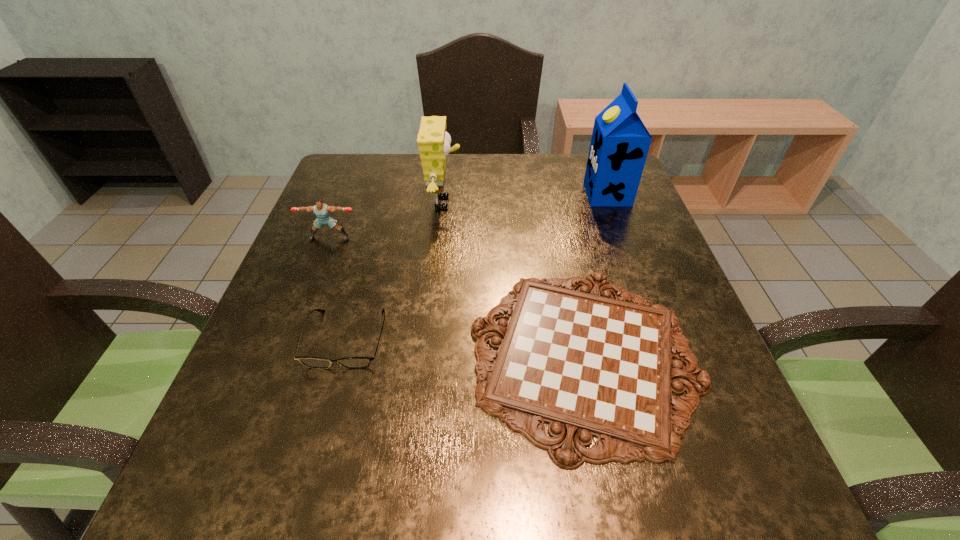
At what (x,y) coordinates should I click in order to perform the action: click on vacant space located on the front-facing side of the third object from right to left. Please return your answer as a coordinate pair (x, y). The width and height of the screenshot is (960, 540). Looking at the image, I should click on (511, 202).

This screenshot has height=540, width=960. Find the location of `vacant point located on the front-facing side of the puncher`. vacant point located on the front-facing side of the puncher is located at coordinates (302, 307).

Where is `vacant area located 0.130m on the front-facing side of the fourth tallest object`? The image size is (960, 540). vacant area located 0.130m on the front-facing side of the fourth tallest object is located at coordinates (318, 441).

Where is `vacant space located on the back of the shortest object`? This screenshot has height=540, width=960. vacant space located on the back of the shortest object is located at coordinates (552, 201).

At what (x,y) coordinates should I click in order to perform the action: click on carton located at the far edge. Please return your answer as a coordinate pair (x, y). Looking at the image, I should click on (620, 142).

Identify the location of sponge located at the far edge. This screenshot has width=960, height=540. tap(433, 141).

I want to click on object that is at the near edge, so click(588, 365).

Locate an element on the screen. This screenshot has width=960, height=540. puncher that is positioned at the left edge is located at coordinates (322, 211).

You are a GUI agent. You are given a task and a screenshot of the screen. Output one action in this format:
    pyautogui.click(x=<x>, y=<y>)
    Task: Click on the spectacles located in the left edge section of the desktop
    The width and height of the screenshot is (960, 540).
    Given the screenshot: What is the action you would take?
    (311, 362)

The height and width of the screenshot is (540, 960). I want to click on carton at the right edge, so click(620, 142).